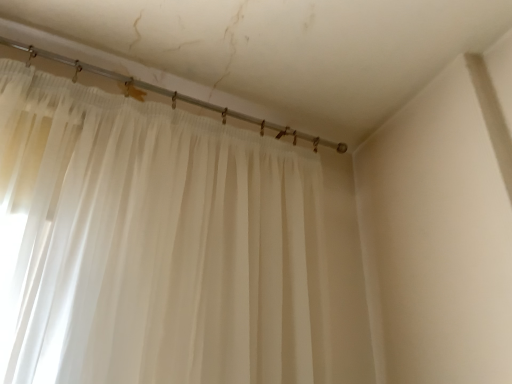
Question: In terms of height, does sheer white curtain at upper left look taller or shorter compared to translucent plastic curtain rod at upper center?

Choices:
 (A) short
 (B) tall

Answer: (B)

Question: Which is correct: sheer white curtain at upper left is inside translucent plastic curtain rod at upper center, or outside of it?

Choices:
 (A) inside
 (B) outside

Answer: (B)

Question: Looking at the image, does sheer white curtain at upper left seem bigger or smaller compared to translucent plastic curtain rod at upper center?

Choices:
 (A) big
 (B) small

Answer: (A)

Question: In terms of size, does translucent plastic curtain rod at upper center appear bigger or smaller than sheer white curtain at upper left?

Choices:
 (A) small
 (B) big

Answer: (A)

Question: In the image, is translucent plastic curtain rod at upper center on the left side or the right side of sheer white curtain at upper left?

Choices:
 (A) right
 (B) left

Answer: (B)

Question: Does point (321, 144) appear closer or farther from the camera than point (303, 344)?

Choices:
 (A) closer
 (B) farther

Answer: (B)

Question: Is translucent plastic curtain rod at upper center wider or thinner than sheer white curtain at upper left?

Choices:
 (A) wide
 (B) thin

Answer: (B)